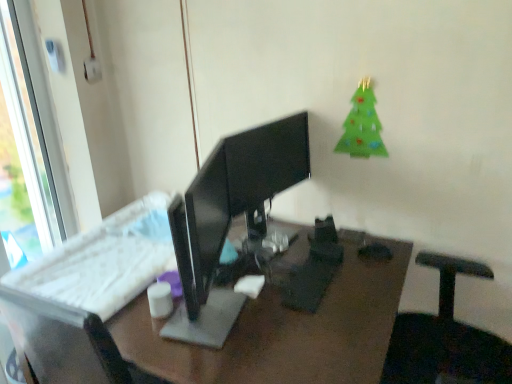
Find the location of a particular element. spots to the right of white matte cup at center is located at coordinates (214, 311).